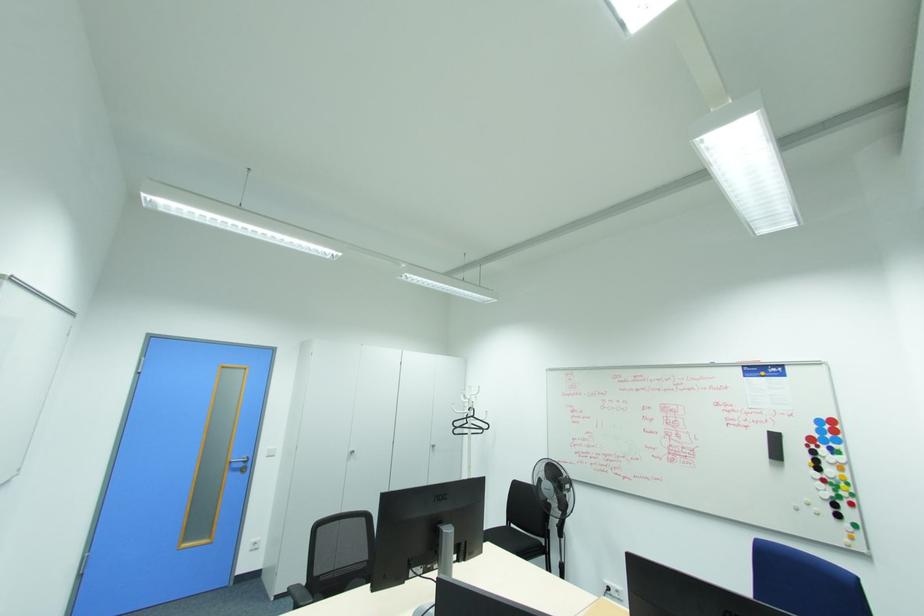
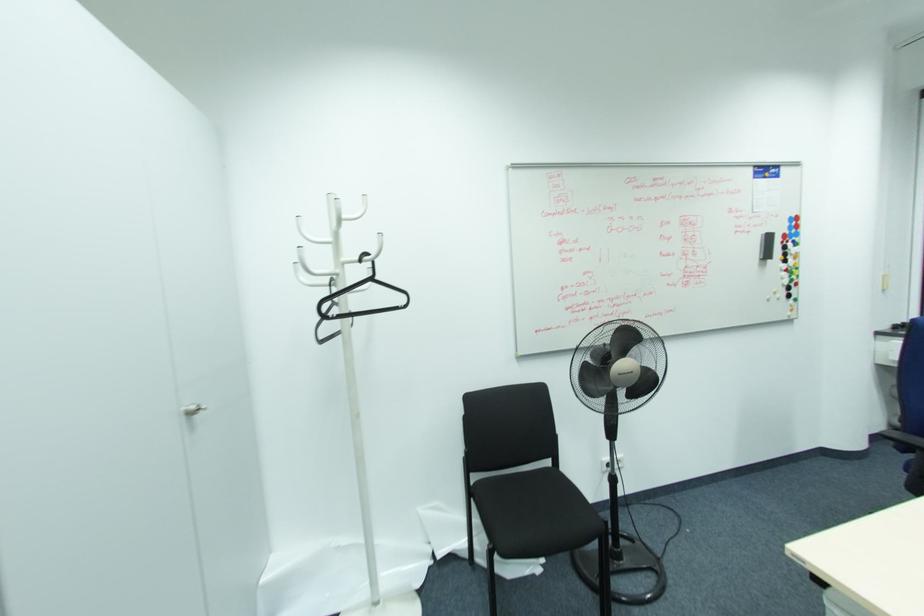
The point at (813, 453) is marked in the first image. Where is the corresponding point in the second image?

(785, 248)